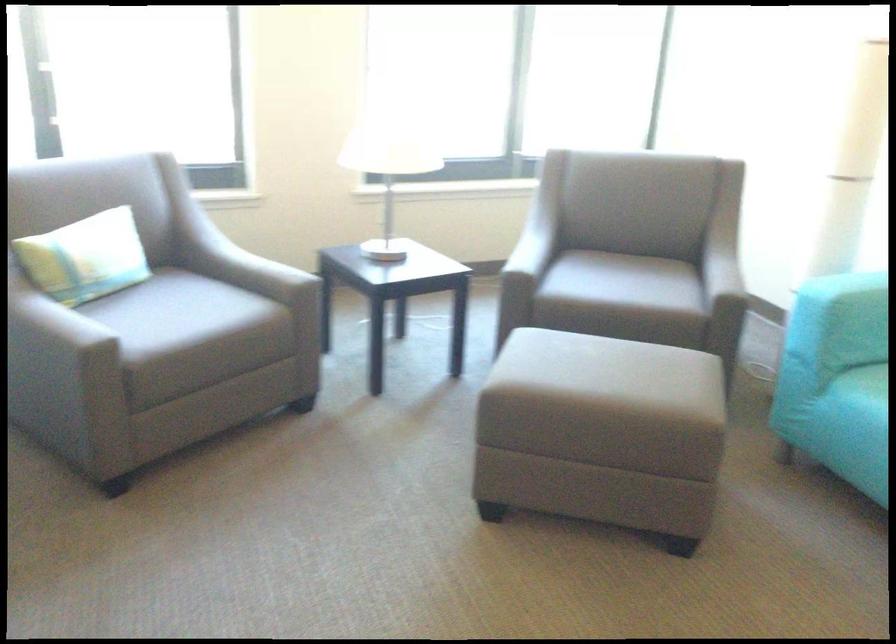
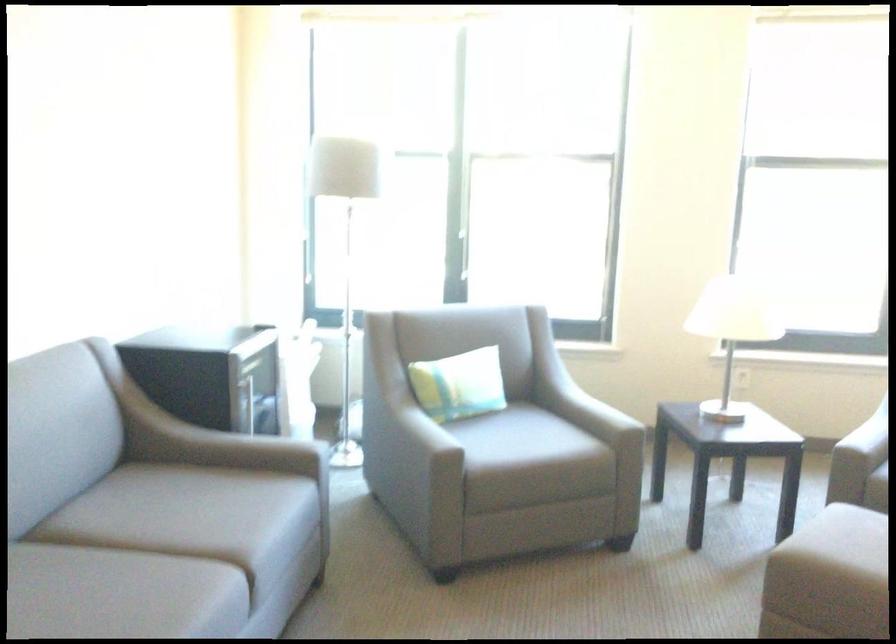
The point at (87, 257) is marked in the first image. Where is the corresponding point in the second image?

(459, 384)